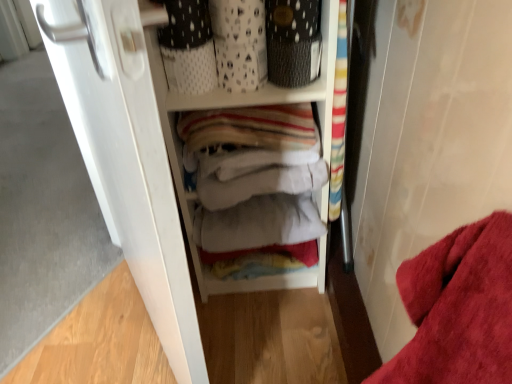
Question: Do you think white matte door at left is within white fabric at center, or outside of it?

Choices:
 (A) inside
 (B) outside

Answer: (B)

Question: Considering the relative positions of white matte door at left and white fabric at center in the image provided, is white matte door at left to the left or to the right of white fabric at center?

Choices:
 (A) left
 (B) right

Answer: (A)

Question: Considering the real-world distances, which object is closest to the white fabric at center?

Choices:
 (A) textured black basket at upper center
 (B) white matte door at left

Answer: (A)

Question: Which object is positioned farthest from the white fabric at center?

Choices:
 (A) white matte door at left
 (B) textured black basket at upper center

Answer: (A)